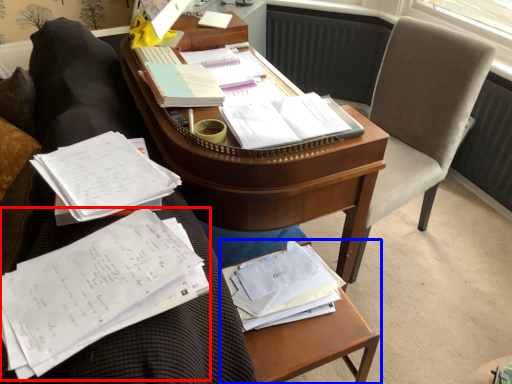
Question: Which point is further to the camera, document (highlighted by a red box) or table (highlighted by a blue box)?

Choices:
 (A) document
 (B) table

Answer: (B)